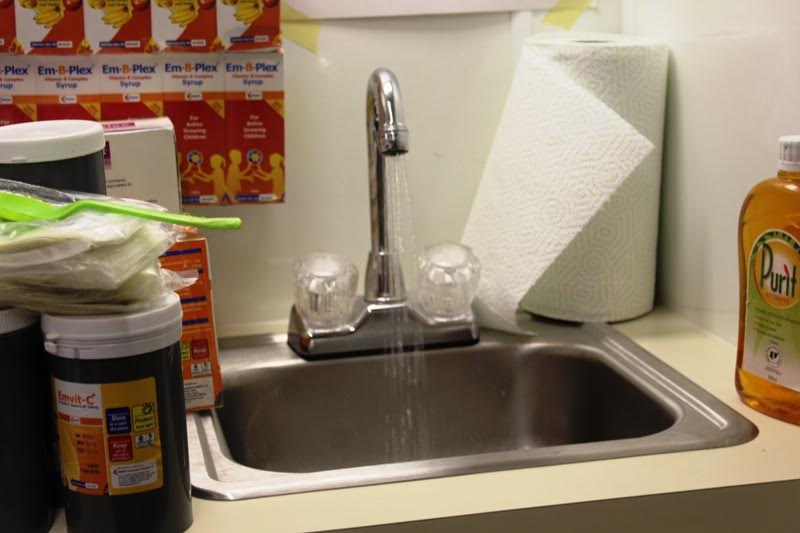
Identify the location of faucet. Image resolution: width=800 pixels, height=533 pixels. (386, 99).